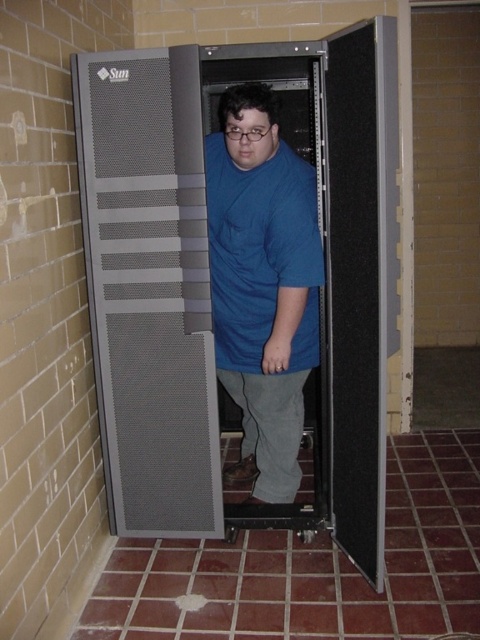
Question: Which point is closer to the camera?

Choices:
 (A) (173, 406)
 (B) (238, 224)

Answer: (B)

Question: Among these points, which one is farthest from the camera?

Choices:
 (A) (280, 525)
 (B) (262, 188)

Answer: (A)

Question: Which point is closer to the camera taking this photo?

Choices:
 (A) (173, 496)
 (B) (243, 321)

Answer: (A)

Question: Can you confirm if gray perforated metal server rack at center is bigger than blue cotton shirt at center?

Choices:
 (A) yes
 (B) no

Answer: (A)

Question: Does gray perforated metal server rack at center appear on the left side of blue cotton shirt at center?

Choices:
 (A) yes
 (B) no

Answer: (A)

Question: Is gray perforated metal server rack at center above blue cotton shirt at center?

Choices:
 (A) no
 (B) yes

Answer: (B)